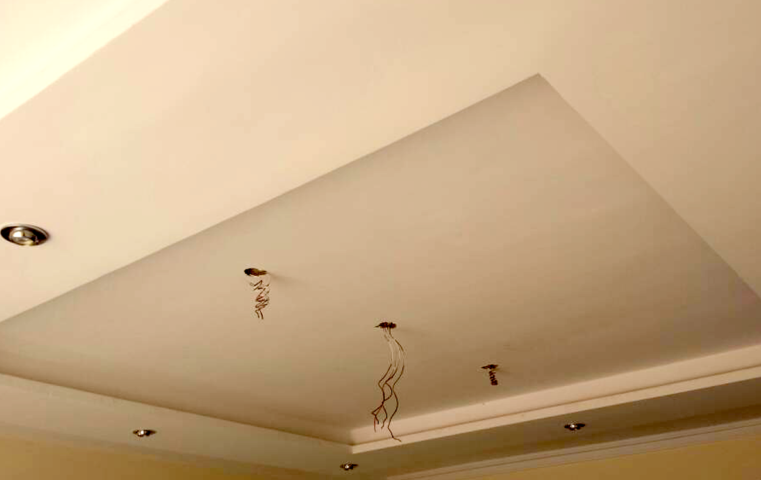
The height and width of the screenshot is (480, 761). Find the location of `holes in ceiling`. holes in ceiling is located at coordinates (390, 325), (253, 270), (489, 367).